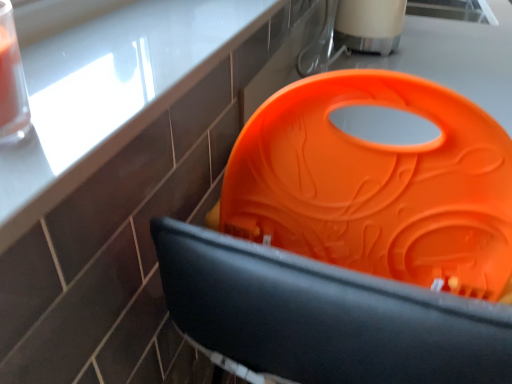
What do you see at coordinates (109, 93) in the screenshot? I see `orange plastic lid at upper right` at bounding box center [109, 93].

Where is `orange plastic lid at upper right`? orange plastic lid at upper right is located at coordinates (109, 93).

What is the approximate height of orange plastic lid at upper right?

1.82 centimeters.

The height and width of the screenshot is (384, 512). What are the coordinates of `orange plastic lid at upper right` in the screenshot? It's located at (109, 93).